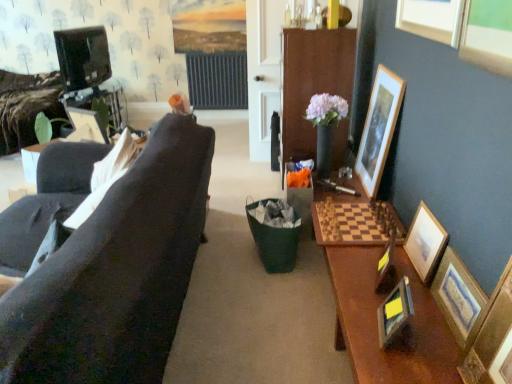
Question: From a real-world perspective, is wooden picture frame at left, which is counted as the first picture frame, starting from the left, positioned above or below wooden cabinet at center?

Choices:
 (A) above
 (B) below

Answer: (A)

Question: In the image, is wooden picture frame at left, which is counted as the first picture frame, starting from the left, positioned in front of or behind wooden cabinet at center?

Choices:
 (A) front
 (B) behind

Answer: (A)

Question: Which is farther from the wooden framed picture at right, the 1th picture frame viewed from the right?

Choices:
 (A) wooden cabinet at center
 (B) wooden picture frame at left, which is counted as the first picture frame, starting from the left
 (C) wooden picture frame at lower right, the fifth picture frame when ordered from right to left
 (D) wooden picture frame at lower right, which is the 2th picture frame in left-to-right order
 (E) wooden picture frame at right, arranged as the fourth picture frame when viewed from the right

Answer: (B)

Question: Considering the real-world distances, which object is closest to the wooden picture frame at right, placed as the 6th picture frame when sorted from left to right?

Choices:
 (A) black glossy television at upper left
 (B) wooden picture frame at right, the 5th picture frame from the left
 (C) wooden picture frame at left, the seventh picture frame positioned from the right
 (D) wooden picture frame at lower right, the fifth picture frame when ordered from right to left
 (E) wooden cabinet at center

Answer: (D)